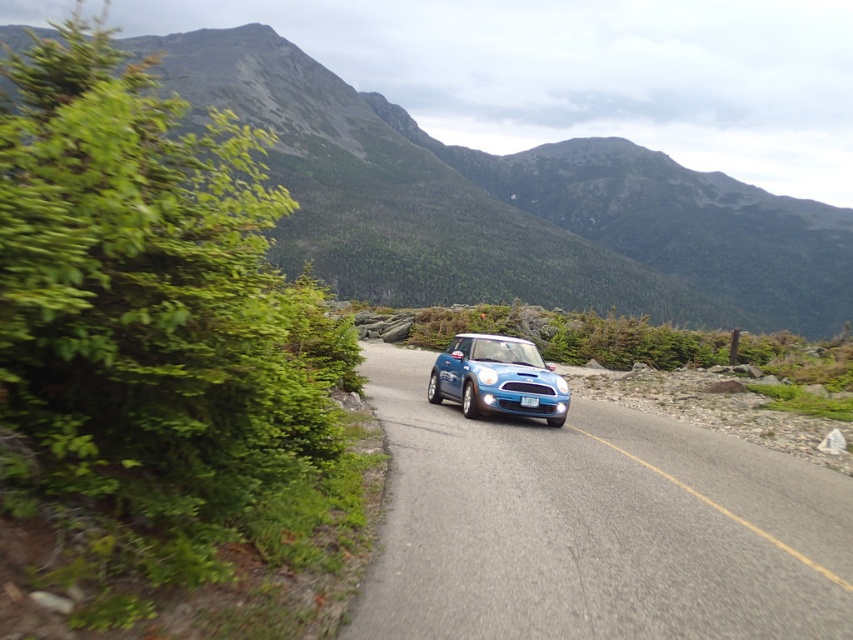
Question: Can you confirm if metallic blue car at center is bigger than blue plastic license plate at center?

Choices:
 (A) yes
 (B) no

Answer: (A)

Question: Which of these objects is positioned closest to the blue plastic license plate at center?

Choices:
 (A) metallic blue car at center
 (B) green forested mountain at upper center

Answer: (A)

Question: Which is farther from the blue plastic license plate at center?

Choices:
 (A) green forested mountain at upper center
 (B) metallic blue car at center
 (C) matte blue car at center

Answer: (A)

Question: Does green forested mountain at upper center have a lesser width compared to blue plastic license plate at center?

Choices:
 (A) no
 (B) yes

Answer: (A)

Question: Is metallic blue car at center below matte blue car at center?

Choices:
 (A) no
 (B) yes

Answer: (B)

Question: Estimate the real-world distances between objects in this image. Which object is farther from the metallic blue car at center?

Choices:
 (A) blue plastic license plate at center
 (B) green forested mountain at upper center

Answer: (B)